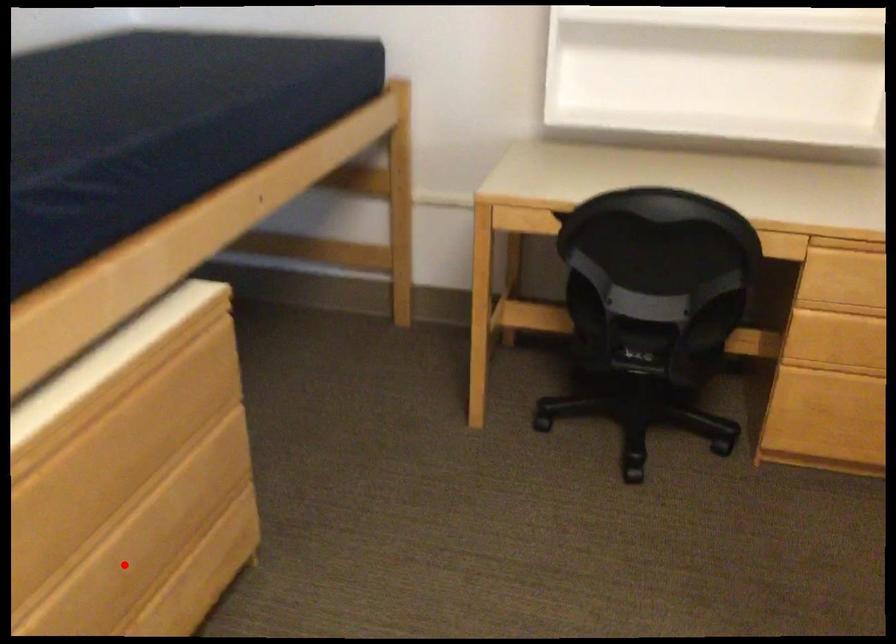
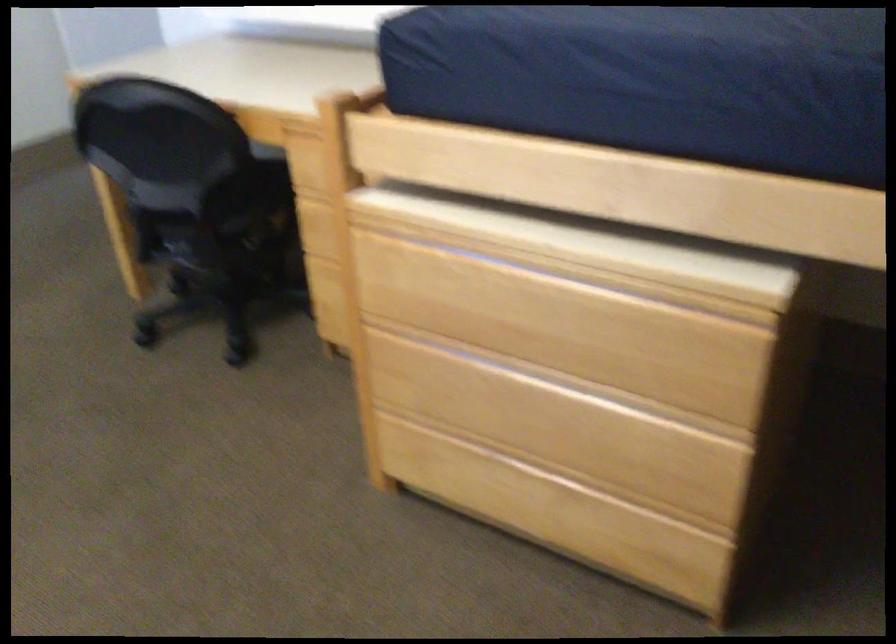
Find the pixel in the second image that matches the highlighted location in the first image.

(529, 410)